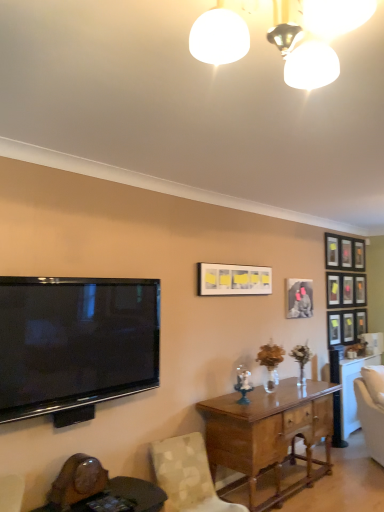
Question: Can you confirm if metallic silver picture frame at upper right, which is counted as the sixth picture frame, starting from the front, is thinner than matte black picture frame at upper right, acting as the 5th picture frame starting from the front?

Choices:
 (A) no
 (B) yes

Answer: (B)

Question: Is metallic silver picture frame at upper right, which appears as the first picture frame when viewed from the back, in contact with matte black picture frame at upper right, marked as the fifth picture frame in a left-to-right arrangement?

Choices:
 (A) no
 (B) yes

Answer: (A)

Question: From a real-world perspective, is metallic silver picture frame at upper right, which ranks as the 6th picture frame in left-to-right order, located higher than matte black picture frame at upper right, arranged as the second picture frame when viewed from the right?

Choices:
 (A) no
 (B) yes

Answer: (B)

Question: Is metallic silver picture frame at upper right, which ranks as the 6th picture frame in left-to-right order, facing towards matte black picture frame at upper right, acting as the 5th picture frame starting from the front?

Choices:
 (A) no
 (B) yes

Answer: (A)

Question: From a real-world perspective, does metallic silver picture frame at upper right, which appears as the first picture frame when viewed from the back, sit lower than matte black picture frame at upper right, arranged as the second picture frame when viewed from the right?

Choices:
 (A) yes
 (B) no

Answer: (B)

Question: Is metallic silver picture frame at upper right, the 1th picture frame from the right, not close to matte black picture frame at upper right, arranged as the second picture frame when viewed from the right?

Choices:
 (A) yes
 (B) no

Answer: (B)

Question: Can you confirm if flat screen tv at left is shorter than matte black picture frame at upper right, the fifth picture frame from the right?

Choices:
 (A) yes
 (B) no

Answer: (B)

Question: Is flat screen tv at left bigger than matte black picture frame at upper right, the fifth picture frame from the right?

Choices:
 (A) no
 (B) yes

Answer: (B)

Question: Can you confirm if flat screen tv at left is wider than matte black picture frame at upper right, which appears as the 2th picture frame when viewed from the front?

Choices:
 (A) yes
 (B) no

Answer: (A)

Question: Can you confirm if flat screen tv at left is taller than matte black picture frame at upper right, the 2th picture frame viewed from the left?

Choices:
 (A) no
 (B) yes

Answer: (B)

Question: Are flat screen tv at left and matte black picture frame at upper right, the fifth picture frame from the right, making contact?

Choices:
 (A) yes
 (B) no

Answer: (B)

Question: Is flat screen tv at left surrounding matte black picture frame at upper right, the 5th picture frame in the back-to-front sequence?

Choices:
 (A) yes
 (B) no

Answer: (B)

Question: Is light brown wood desk at center positioned before matte black picture frame at upper right, the 5th picture frame in the back-to-front sequence?

Choices:
 (A) yes
 (B) no

Answer: (A)